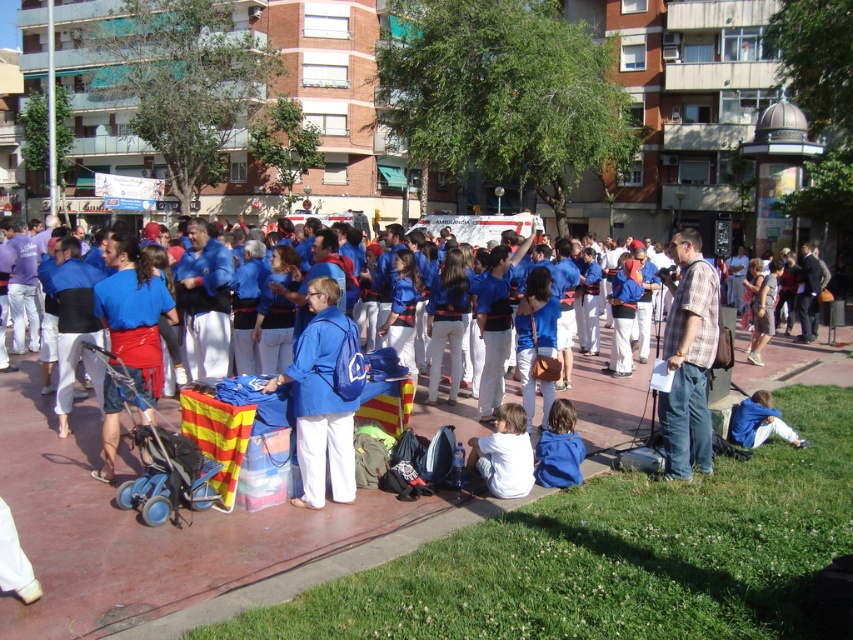
Question: Which is nearer to the plaid fabric shirt at right?

Choices:
 (A) blue fabric at center
 (B) matte blue jacket at center

Answer: (B)

Question: In this image, where is blue fabric bag at center located relative to blue fabric jacket at lower right?

Choices:
 (A) left
 (B) right

Answer: (A)

Question: Which of the following is the farthest from the observer?

Choices:
 (A) pyautogui.click(x=674, y=401)
 (B) pyautogui.click(x=260, y=568)
 (C) pyautogui.click(x=770, y=420)

Answer: (C)

Question: Which point is closer to the camera taking this photo?

Choices:
 (A) (343, 433)
 (B) (102, 618)
 (C) (473, 460)

Answer: (B)

Question: Does blue fabric at center appear on the right side of blue fabric jacket at lower right?

Choices:
 (A) yes
 (B) no

Answer: (B)

Question: Can you confirm if blue plastic baby carriage at lower left is bigger than blue fabric jacket at lower right?

Choices:
 (A) no
 (B) yes

Answer: (B)